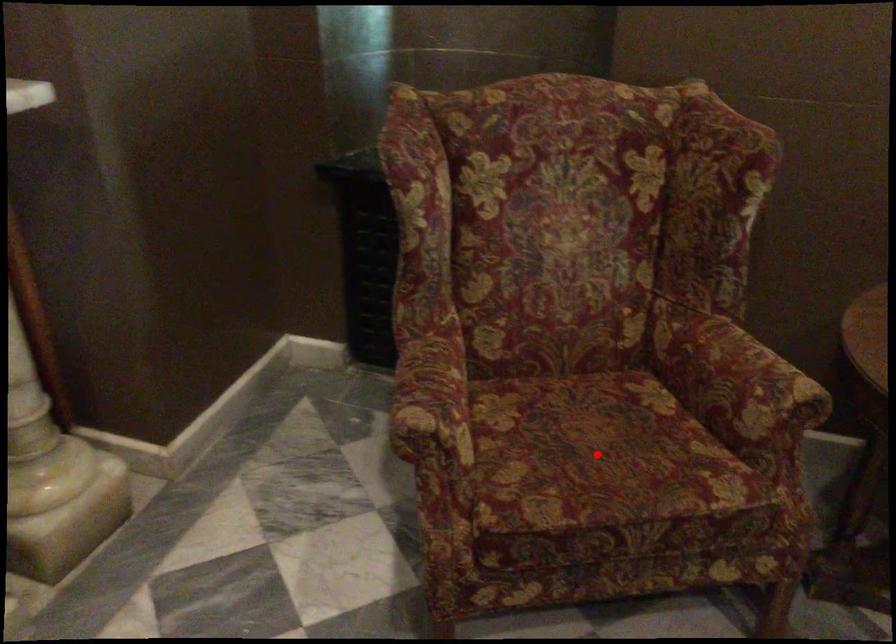
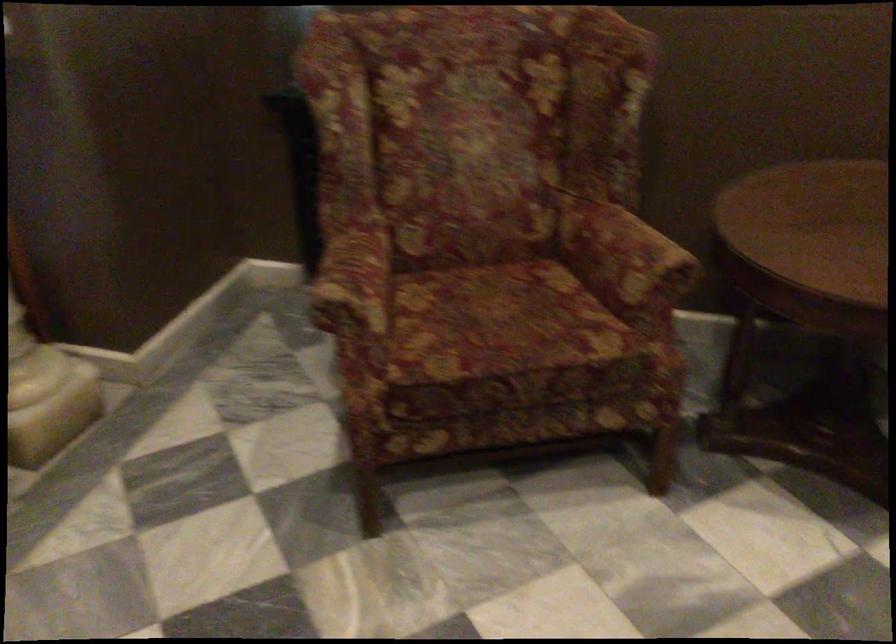
Question: A red point is marked in image1. In image2, is the corresponding 3D point closer to the camera or farther? Reply with the corresponding letter.

Choices:
 (A) The corresponding 3D point is closer.
 (B) The corresponding 3D point is farther.

Answer: (B)